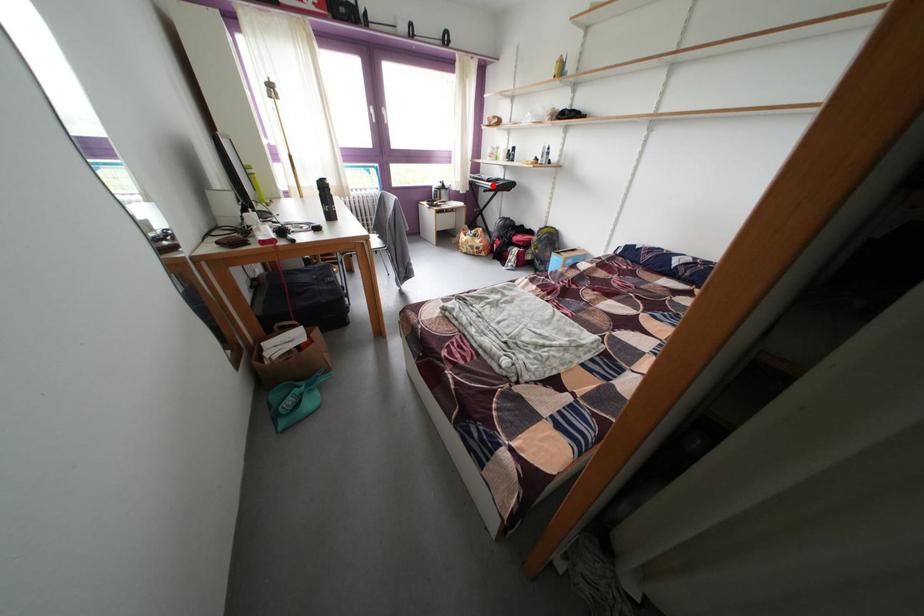
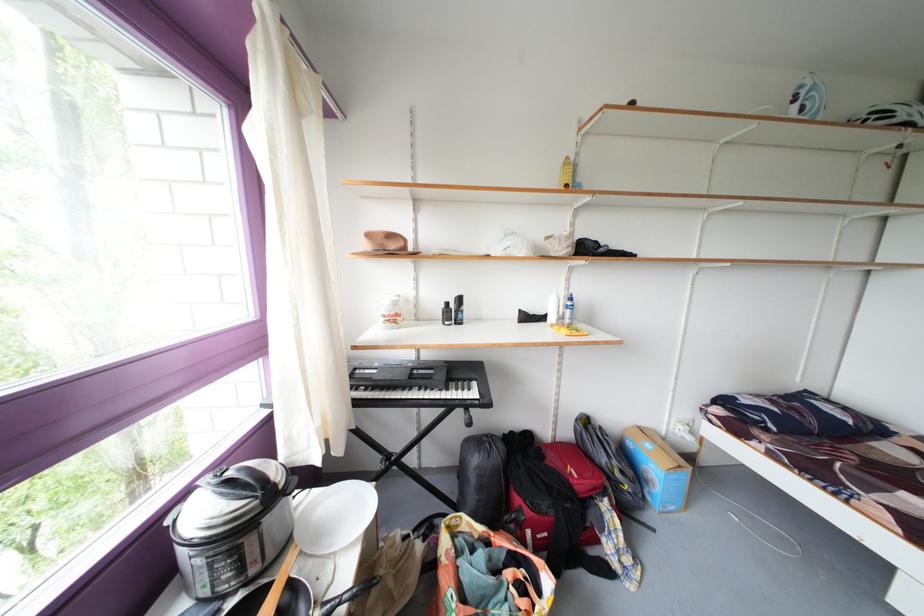
Question: I am providing you with two images of the same scene from different viewpoints. In image1, a red point is highlighted. Considering the same 3D point in image2, which of the following is correct?

Choices:
 (A) It is closer
 (B) It is farther

Answer: (B)